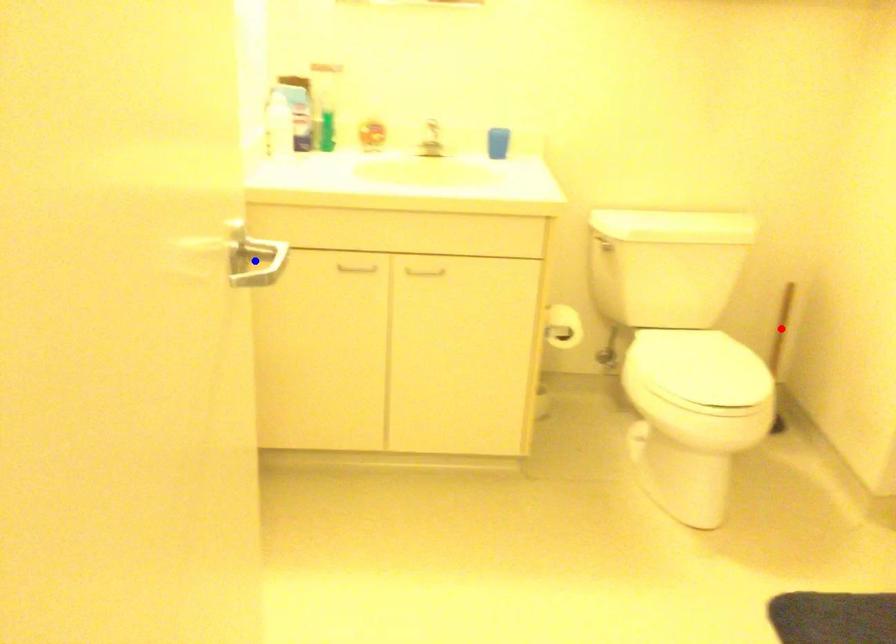
Question: Two points are marked on the image. Which point is closer to the camera?

Choices:
 (A) Blue point is closer.
 (B) Red point is closer.

Answer: (A)